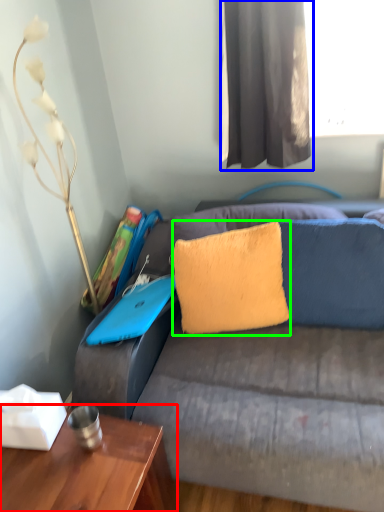
Question: Based on their relative distances, which object is farther from table (highlighted by a red box)? Choose from curtain (highlighted by a blue box) and pillow (highlighted by a green box).

Choices:
 (A) curtain
 (B) pillow

Answer: (A)